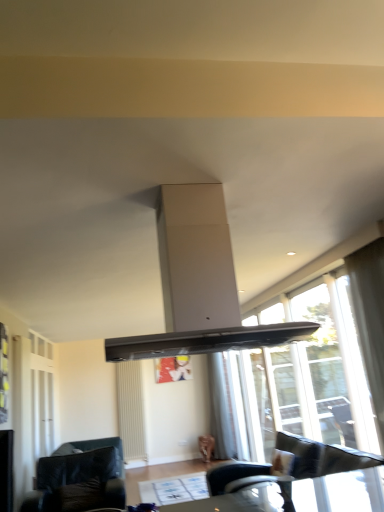
Question: Is white matte exhaust hood at center at the left side of white matte radiator at lower left?

Choices:
 (A) yes
 (B) no

Answer: (B)

Question: From the image's perspective, does white matte exhaust hood at center appear lower than white matte radiator at lower left?

Choices:
 (A) yes
 (B) no

Answer: (B)

Question: Can you confirm if white matte exhaust hood at center is smaller than white matte radiator at lower left?

Choices:
 (A) yes
 (B) no

Answer: (B)

Question: Can white matte radiator at lower left be found inside white matte exhaust hood at center?

Choices:
 (A) yes
 (B) no

Answer: (B)

Question: Is white matte exhaust hood at center facing away from white matte radiator at lower left?

Choices:
 (A) yes
 (B) no

Answer: (A)

Question: Is black leather couch at lower left bigger or smaller than white matte radiator at lower left?

Choices:
 (A) small
 (B) big

Answer: (B)

Question: Is black leather couch at lower left in front of or behind white matte radiator at lower left in the image?

Choices:
 (A) behind
 (B) front

Answer: (B)

Question: In terms of height, does black leather couch at lower left look taller or shorter compared to white matte radiator at lower left?

Choices:
 (A) short
 (B) tall

Answer: (A)

Question: Is black leather couch at lower left spatially inside white matte radiator at lower left, or outside of it?

Choices:
 (A) outside
 (B) inside

Answer: (A)

Question: Considering the positions of black leather couch at lower left and white sheer curtain at center in the image, is black leather couch at lower left taller or shorter than white sheer curtain at center?

Choices:
 (A) short
 (B) tall

Answer: (A)

Question: Is point (69, 448) positioned closer to the camera than point (220, 417)?

Choices:
 (A) closer
 (B) farther

Answer: (A)

Question: In terms of width, does black leather couch at lower left look wider or thinner when compared to white sheer curtain at center?

Choices:
 (A) thin
 (B) wide

Answer: (B)

Question: From a real-world perspective, relative to white sheer curtain at center, is black leather couch at lower left vertically above or below?

Choices:
 (A) below
 (B) above

Answer: (A)

Question: Considering their positions, is white matte exhaust hood at center located in front of or behind transparent glass window at right?

Choices:
 (A) behind
 (B) front

Answer: (B)

Question: Considering the positions of point (145, 339) and point (256, 437), is point (145, 339) closer or farther from the camera than point (256, 437)?

Choices:
 (A) farther
 (B) closer

Answer: (B)